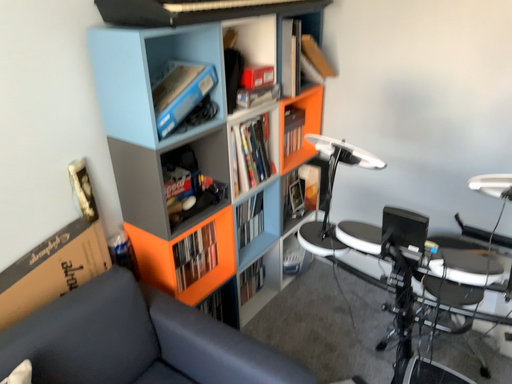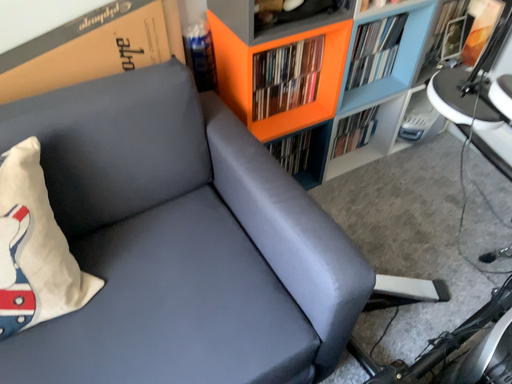
Question: Which way did the camera rotate in the video?

Choices:
 (A) rotated left
 (B) rotated right

Answer: (A)